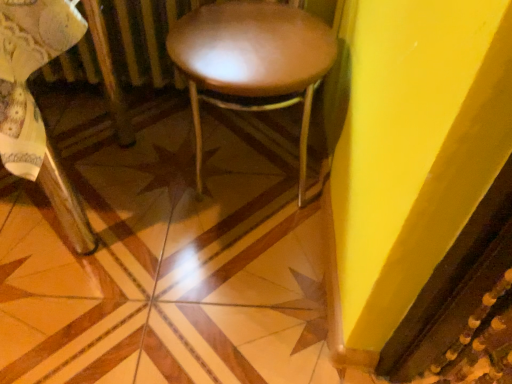
Question: Can you confirm if wooden chair at center is bigger than wooden floor at center?

Choices:
 (A) no
 (B) yes

Answer: (B)

Question: Would you say wooden chair at center contains wooden floor at center?

Choices:
 (A) yes
 (B) no

Answer: (B)

Question: Can you confirm if wooden chair at center is wider than wooden floor at center?

Choices:
 (A) no
 (B) yes

Answer: (A)

Question: Are wooden chair at center and wooden floor at center located far from each other?

Choices:
 (A) no
 (B) yes

Answer: (A)

Question: Does wooden chair at center lie in front of wooden floor at center?

Choices:
 (A) yes
 (B) no

Answer: (A)

Question: Visually, is wooden floor at center positioned to the left or to the right of wooden chair at center?

Choices:
 (A) left
 (B) right

Answer: (B)

Question: Is wooden floor at center situated inside wooden chair at center or outside?

Choices:
 (A) inside
 (B) outside

Answer: (B)

Question: Relative to wooden chair at center, is wooden floor at center in front or behind?

Choices:
 (A) behind
 (B) front

Answer: (A)

Question: From the image's perspective, relative to wooden chair at center, is wooden floor at center above or below?

Choices:
 (A) above
 (B) below

Answer: (B)

Question: From the image's perspective, is leather-like brown stool at center above or below wooden chair at center?

Choices:
 (A) below
 (B) above

Answer: (B)

Question: From a real-world perspective, is leather-like brown stool at center physically located above or below wooden chair at center?

Choices:
 (A) above
 (B) below

Answer: (B)

Question: Does point (286, 14) appear closer or farther from the camera than point (54, 21)?

Choices:
 (A) farther
 (B) closer

Answer: (A)

Question: Is leather-like brown stool at center wider or thinner than wooden chair at center?

Choices:
 (A) wide
 (B) thin

Answer: (B)

Question: Do you think wooden floor at center is within leather-like brown stool at center, or outside of it?

Choices:
 (A) outside
 (B) inside

Answer: (A)

Question: Is point (144, 135) positioned closer to the camera than point (175, 31)?

Choices:
 (A) closer
 (B) farther

Answer: (B)